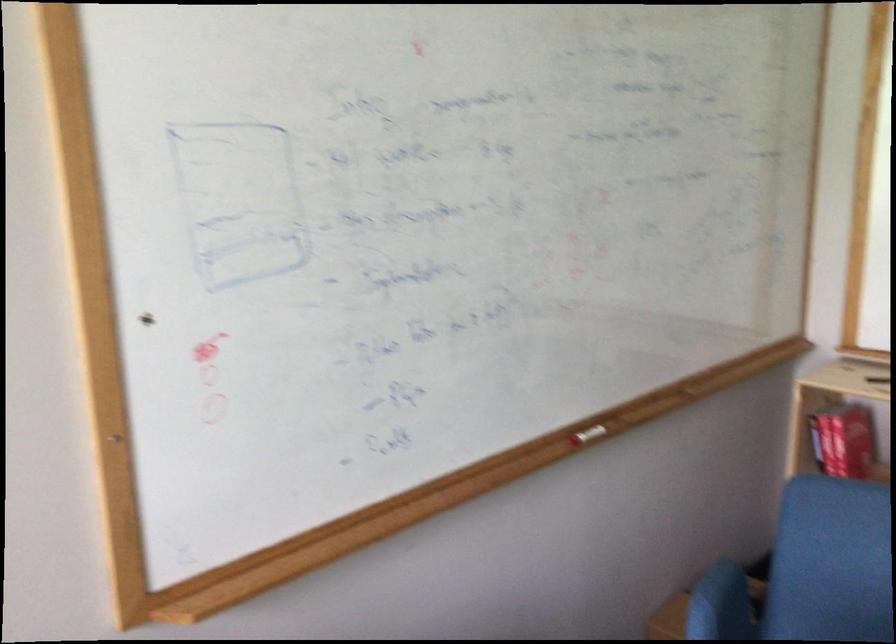
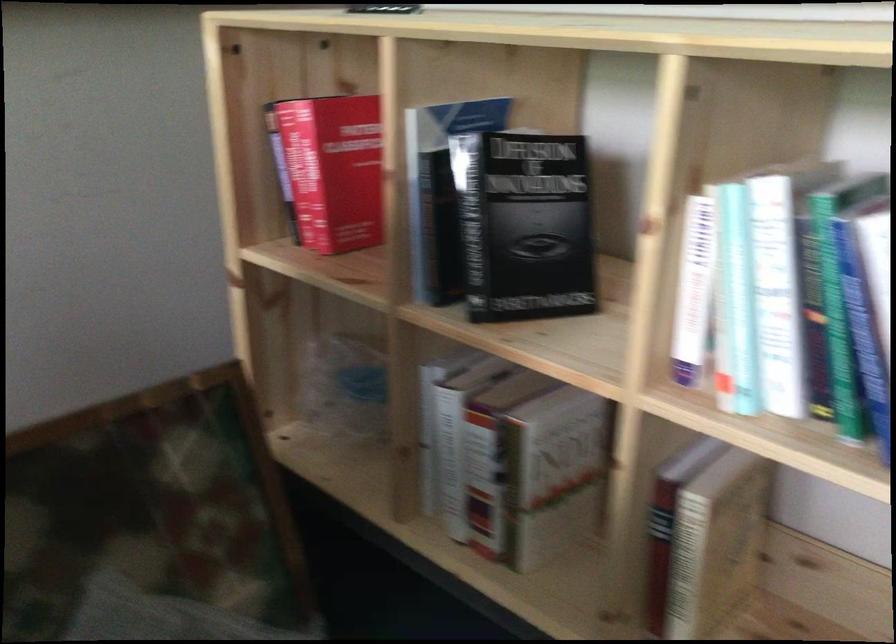
In a continuous first-person perspective shot, in which direction is the camera moving?

The cameraman walked toward right, forward.